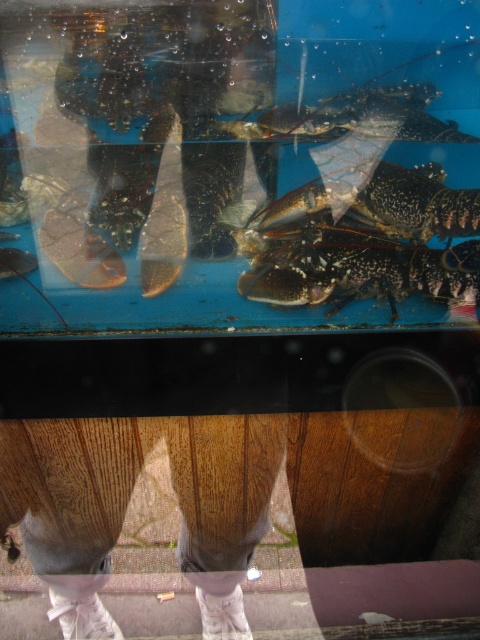
Who is shorter, speckled shell lobster at center or shiny black lobster at upper center?

With less height is shiny black lobster at upper center.

The width and height of the screenshot is (480, 640). What do you see at coordinates (354, 268) in the screenshot?
I see `speckled shell lobster at center` at bounding box center [354, 268].

The height and width of the screenshot is (640, 480). I want to click on speckled shell lobster at center, so click(354, 268).

You are a GUI agent. You are given a task and a screenshot of the screen. Output one action in this format:
    pyautogui.click(x=<x>, y=<y>)
    Task: Click on the speckled shell lobster at center
    Image resolution: width=480 pixels, height=640 pixels.
    Given the screenshot: What is the action you would take?
    coord(354,268)